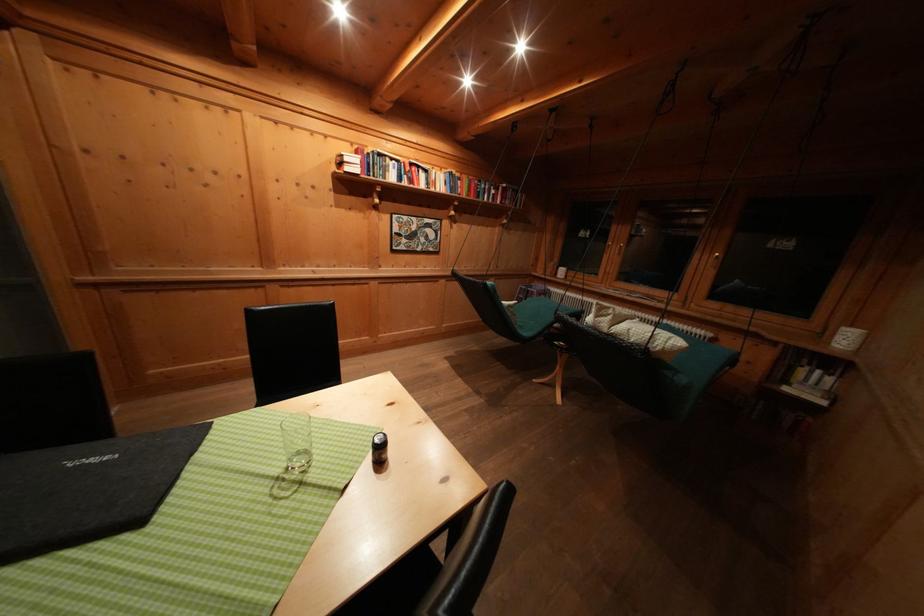
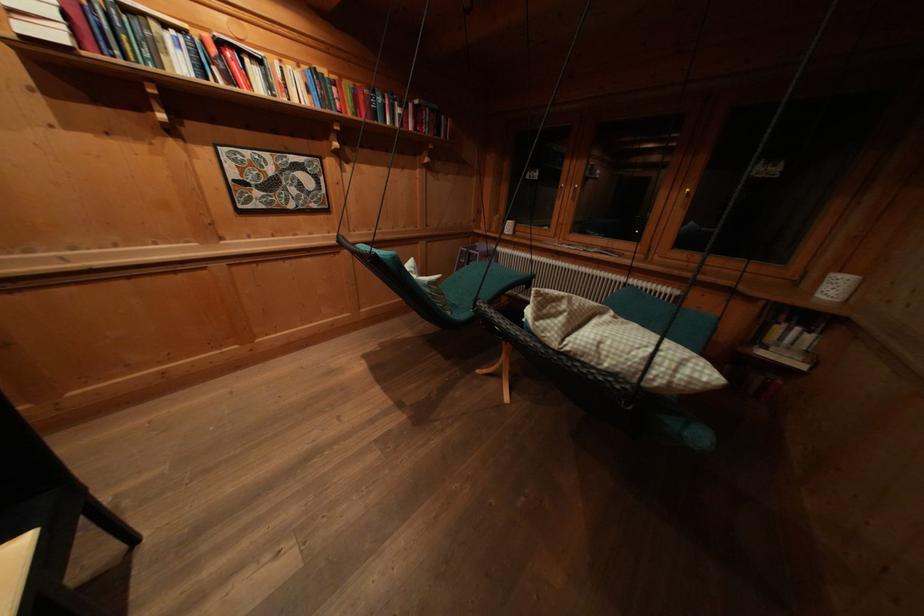
In the second image, find the point that corresponds to [418,169] in the first image.

(225, 47)